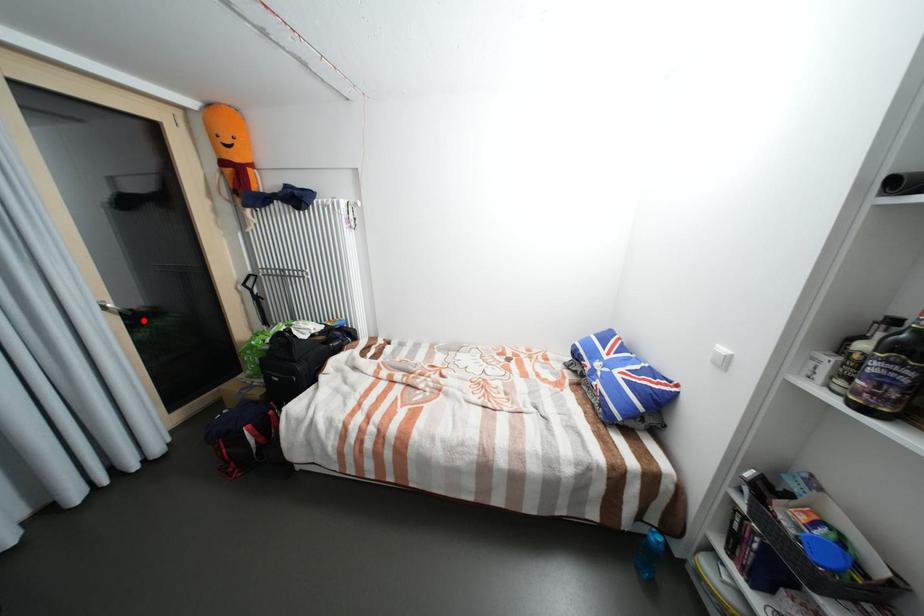
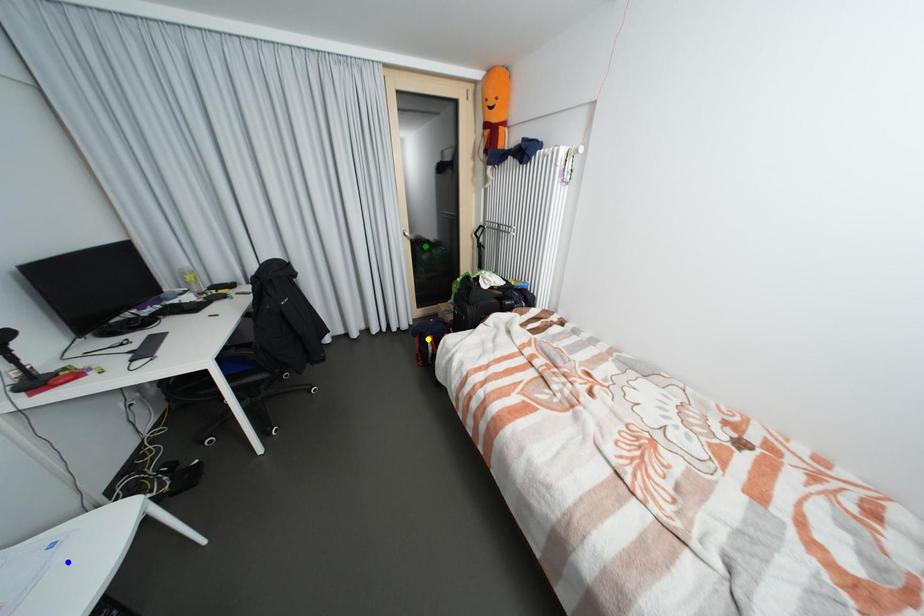
Question: I am providing you with two images of the same scene from different viewpoints. A red point is marked on the first image. You are given multiple points on the second image. In image 2, which mark is for the same physical point as the one in image 1?

Choices:
 (A) green point
 (B) yellow point
 (C) blue point

Answer: (A)